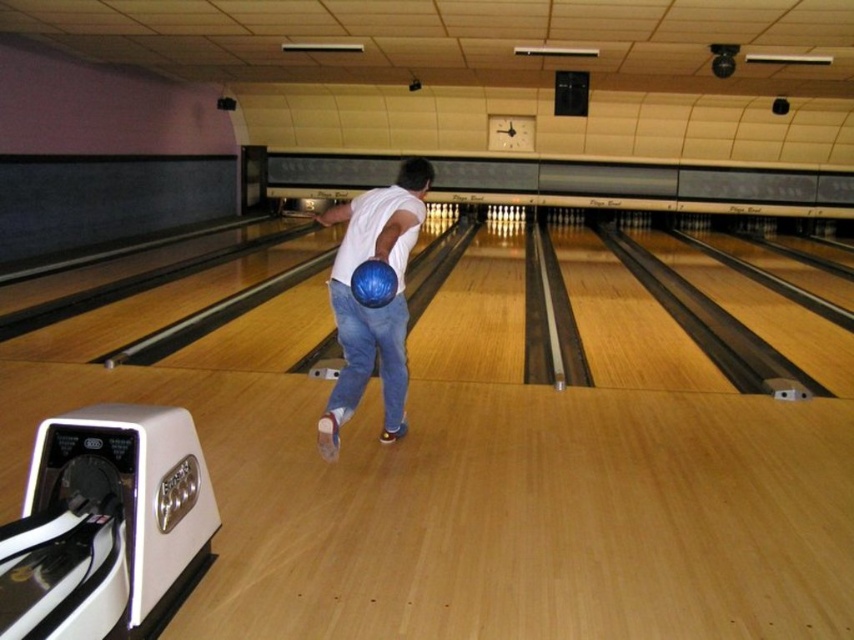
Question: Observing the image, what is the correct spatial positioning of blue denim jeans at center in reference to blue rubber bowling ball at center?

Choices:
 (A) left
 (B) right

Answer: (A)

Question: Is blue matte bowling ball at center to the left of blue rubber bowling ball at center from the viewer's perspective?

Choices:
 (A) no
 (B) yes

Answer: (B)

Question: Is blue denim jeans at center in front of blue rubber bowling ball at center?

Choices:
 (A) no
 (B) yes

Answer: (A)

Question: Considering the real-world distances, which object is closest to the blue rubber bowling ball at center?

Choices:
 (A) blue denim jeans at center
 (B) blue matte bowling ball at center

Answer: (B)

Question: Which point is closer to the camera?

Choices:
 (A) blue rubber bowling ball at center
 (B) blue denim jeans at center

Answer: (A)

Question: Which point is closer to the camera taking this photo?

Choices:
 (A) (363, 298)
 (B) (395, 388)

Answer: (A)